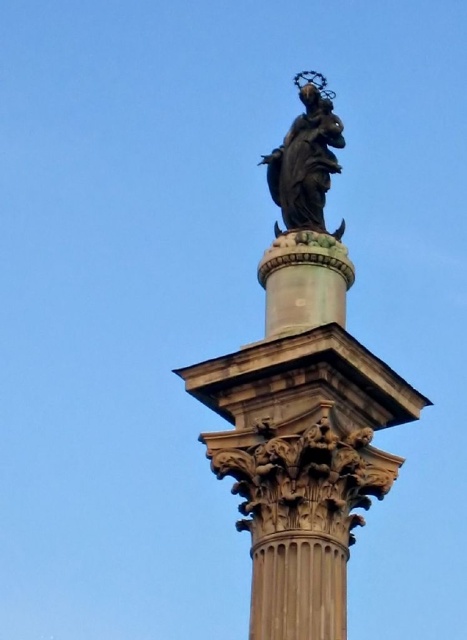
You are an art conservator assessing the placement of two bronze statues in a classical column setting. The scene includes a bronze statue at upper center and a polished bronze statue at center. Based on their positions, which statue would require more frequent maintenance due to its exposure to environmental elements?

The bronze statue at upper center would require more frequent maintenance because it is taller than the polished bronze statue at center, making it more exposed to environmental elements like rain and wind.